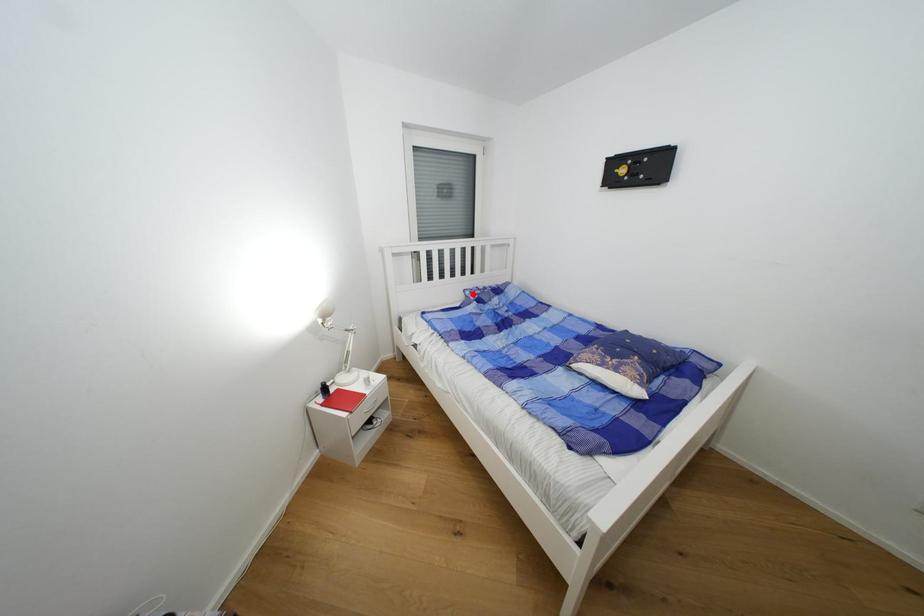
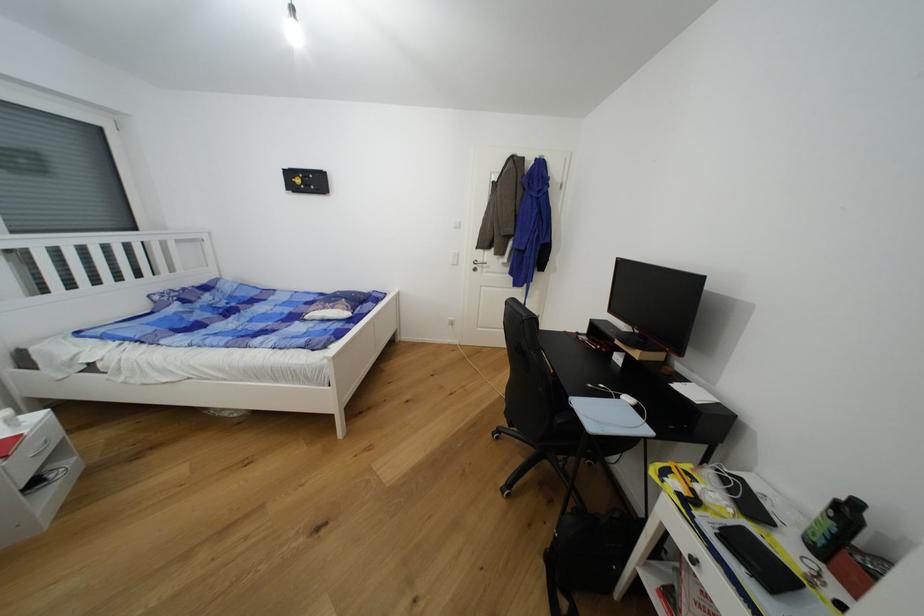
Where in the second image is the point corresponding to the highlighted location from the first image?

(162, 299)